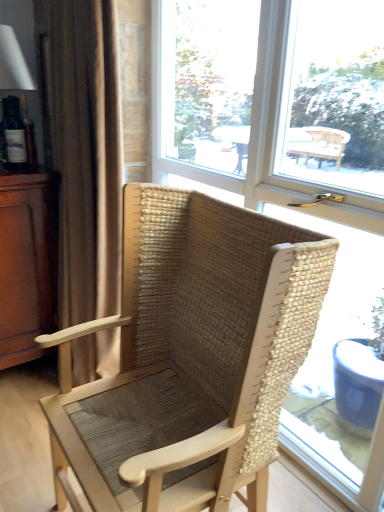
Image resolution: width=384 pixels, height=512 pixels. Describe the element at coordinates (27, 264) in the screenshot. I see `brown wood dresser at left` at that location.

This screenshot has width=384, height=512. I want to click on natural woven wood chair at center, so click(x=190, y=357).

Describe the element at coordinates (86, 154) in the screenshot. I see `brown fabric curtain at left` at that location.

Find the location of a particular element. The width and height of the screenshot is (384, 512). brown wood dresser at left is located at coordinates (27, 264).

Are matte white table lamp at left and transparent glass window at center beside each other?

No, matte white table lamp at left is not next to transparent glass window at center.

Looking at their sizes, would you say matte white table lamp at left is wider or thinner than transparent glass window at center?

Clearly, matte white table lamp at left has more width compared to transparent glass window at center.

Which is closer to the camera, (8, 152) or (327, 414)?

Point (8, 152) is positioned closer to the camera compared to point (327, 414).

Considering the sizes of objects matte white table lamp at left and transparent glass window at center in the image provided, who is shorter, matte white table lamp at left or transparent glass window at center?

matte white table lamp at left.

Based on the photo, between transparent glass window at center and matte white table lamp at left, which one has larger width?

With larger width is matte white table lamp at left.

Considering the sizes of objects transparent glass window at center and matte white table lamp at left in the image provided, who is taller, transparent glass window at center or matte white table lamp at left?

transparent glass window at center.

Can you tell me how much transparent glass window at center and matte white table lamp at left differ in facing direction?

The angular difference between transparent glass window at center and matte white table lamp at left is 86.8 degrees.

Locate an element on the screen. chair below the transparent glass window at center (from the image's perspective) is located at coordinates (190, 357).

From the image's perspective, is natural woven wood chair at center located beneath transparent glass window at center?

Yes, from the image's perspective, natural woven wood chair at center is beneath transparent glass window at center.

Who is shorter, natural woven wood chair at center or transparent glass window at center?

natural woven wood chair at center.

Is brown wood dresser at left with transparent glass window at center?

There is a gap between brown wood dresser at left and transparent glass window at center.

From the image's perspective, which one is positioned higher, brown wood dresser at left or transparent glass window at center?

transparent glass window at center is shown above in the image.

The image size is (384, 512). What are the coordinates of `window on the right side of brown wood dresser at left` in the screenshot? It's located at (291, 179).

Considering the relative sizes of brown wood dresser at left and transparent glass window at center in the image provided, is brown wood dresser at left shorter than transparent glass window at center?

Yes.

Who is shorter, natural woven wood chair at center or brown wood dresser at left?

With less height is brown wood dresser at left.

Based on their positions, is natural woven wood chair at center located to the left or right of brown wood dresser at left?

Clearly, natural woven wood chair at center is on the right of brown wood dresser at left in the image.

Based on the photo, which object is thinner, natural woven wood chair at center or brown wood dresser at left?

natural woven wood chair at center.

From the image's perspective, is natural woven wood chair at center above or below brown wood dresser at left?

Clearly, from the image's perspective, natural woven wood chair at center is below brown wood dresser at left.

Considering the positions of objects matte white table lamp at left and brown fabric curtain at left in the image provided, who is more to the right, matte white table lamp at left or brown fabric curtain at left?

From the viewer's perspective, brown fabric curtain at left appears more on the right side.

Are matte white table lamp at left and brown fabric curtain at left making contact?

matte white table lamp at left is not next to brown fabric curtain at left, and they're not touching.

At what (x,y) coordinates should I click in order to perform the action: click on table lamp behind the brown fabric curtain at left. Please return your answer as a coordinate pair (x, y). The width and height of the screenshot is (384, 512). Looking at the image, I should click on (13, 63).

Would you say brown fabric curtain at left is part of matte white table lamp at left's contents?

That's incorrect, brown fabric curtain at left is not inside matte white table lamp at left.

Considering the positions of objects brown fabric curtain at left and transparent glass window at center in the image provided, who is more to the right, brown fabric curtain at left or transparent glass window at center?

transparent glass window at center is more to the right.

Is brown fabric curtain at left turned away from transparent glass window at center?

That's right, brown fabric curtain at left is facing away from transparent glass window at center.

Which of these two, brown fabric curtain at left or transparent glass window at center, is thinner?

transparent glass window at center is thinner.

Is brown fabric curtain at left spatially inside transparent glass window at center, or outside of it?

brown fabric curtain at left exists outside the volume of transparent glass window at center.

The image size is (384, 512). Find the location of `table lamp that is above the transparent glass window at center (from a real-world perspective)`. table lamp that is above the transparent glass window at center (from a real-world perspective) is located at coordinates (13, 63).

This screenshot has width=384, height=512. I want to click on window that appears on the right of matte white table lamp at left, so click(291, 179).

When comparing their distances from brown wood dresser at left, does matte white table lamp at left or natural woven wood chair at center seem further?

The object further to brown wood dresser at left is natural woven wood chair at center.

Based on their spatial positions, is brown fabric curtain at left or transparent glass window at center further from natural woven wood chair at center?

brown fabric curtain at left is further to natural woven wood chair at center.

Looking at the image, which one is located further to natural woven wood chair at center, transparent glass window at center or matte white table lamp at left?

The object further to natural woven wood chair at center is matte white table lamp at left.

When comparing their distances from brown fabric curtain at left, does natural woven wood chair at center or matte white table lamp at left seem closer?

The object closer to brown fabric curtain at left is matte white table lamp at left.

Considering their positions, is brown fabric curtain at left positioned closer to matte white table lamp at left than natural woven wood chair at center?

brown fabric curtain at left is closer to matte white table lamp at left.

Based on their spatial positions, is natural woven wood chair at center or transparent glass window at center further from brown wood dresser at left?

natural woven wood chair at center is further to brown wood dresser at left.

Which object lies nearer to the anchor point matte white table lamp at left, natural woven wood chair at center or brown fabric curtain at left?

brown fabric curtain at left.

From the image, which object appears to be nearer to matte white table lamp at left, transparent glass window at center or natural woven wood chair at center?

transparent glass window at center.

At what (x,y) coordinates should I click in order to perform the action: click on dresser between natural woven wood chair at center and matte white table lamp at left in the front-back direction. Please return your answer as a coordinate pair (x, y). This screenshot has width=384, height=512. Looking at the image, I should click on (27, 264).

At what (x,y) coordinates should I click in order to perform the action: click on chair between matte white table lamp at left and transparent glass window at center from left to right. Please return your answer as a coordinate pair (x, y). Looking at the image, I should click on (190, 357).

At what (x,y) coordinates should I click in order to perform the action: click on chair situated between brown fabric curtain at left and transparent glass window at center from left to right. Please return your answer as a coordinate pair (x, y). This screenshot has height=512, width=384. Looking at the image, I should click on (190, 357).

You are a GUI agent. You are given a task and a screenshot of the screen. Output one action in this format:
    pyautogui.click(x=<x>, y=<y>)
    Task: Click on the curtain that lies between matte white table lamp at left and brown wood dresser at left from top to bottom
    
    Given the screenshot: What is the action you would take?
    pyautogui.click(x=86, y=154)